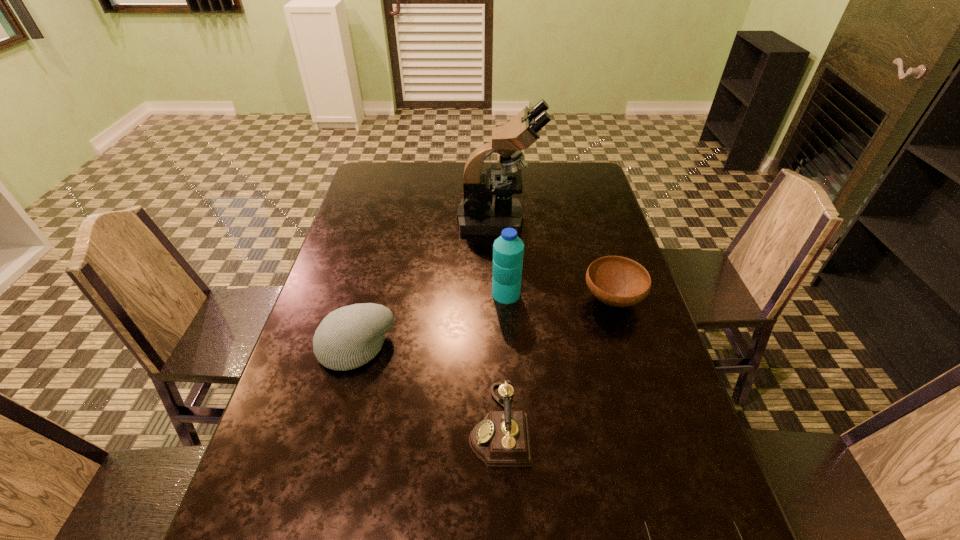
Find the location of a particular element. The image size is (960, 540). vacant point located between the tallest object and the fifth farthest object is located at coordinates (499, 322).

In order to click on free space that is in between the second nearest object and the farthest object in this screenshot , I will do `click(499, 322)`.

You are a GUI agent. You are given a task and a screenshot of the screen. Output one action in this format:
    pyautogui.click(x=<x>, y=<y>)
    Task: Click on the vacant space that's between the farthest object and the bowl
    
    Given the screenshot: What is the action you would take?
    pyautogui.click(x=556, y=260)

Image resolution: width=960 pixels, height=540 pixels. In order to click on vacant space that's between the third nearest object and the microscope in this screenshot , I will do `click(427, 284)`.

Where is `free space between the leftmost object and the microscope`? This screenshot has height=540, width=960. free space between the leftmost object and the microscope is located at coordinates (427, 284).

At what (x,y) coordinates should I click in order to perform the action: click on vacant area that lies between the bowl and the telephone. Please return your answer as a coordinate pair (x, y). This screenshot has height=540, width=960. Looking at the image, I should click on (556, 362).

Identify which object is the closest to the nearest object. Please provide its 2D coordinates. Your answer should be formatted as a tuple, i.e. [(x, y)], where the tuple contains the x and y coordinates of a point satisfying the conditions above.

[(502, 439)]

Identify which object is located as the third nearest to the tallest object. Please provide its 2D coordinates. Your answer should be formatted as a tuple, i.e. [(x, y)], where the tuple contains the x and y coordinates of a point satisfying the conditions above.

[(349, 337)]

The image size is (960, 540). Identify the location of vacant region that satisfies the following two spatial constraints: 1. on the front side of the tallest object; 2. on the dial of the second nearest object. (509, 425).

I want to click on vacant space that satisfies the following two spatial constraints: 1. on the front side of the microscope; 2. on the dial of the telephone, so click(509, 425).